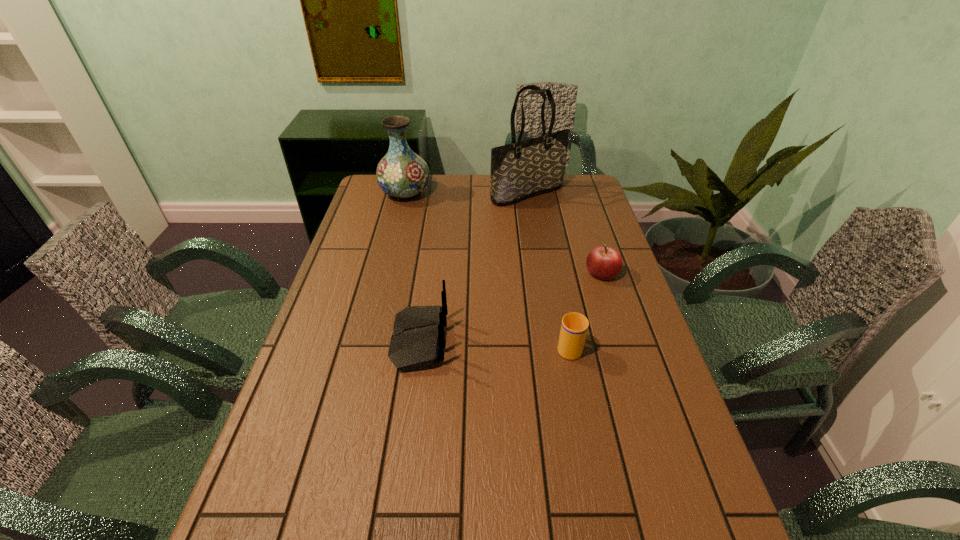
You are a GUI agent. You are given a task and a screenshot of the screen. Output one action in this format:
    pyautogui.click(x=<x>, y=<y>)
    Task: Click on the tallest object
    The width and height of the screenshot is (960, 540).
    Given the screenshot: What is the action you would take?
    pyautogui.click(x=522, y=169)

What are the coordinates of `the fourth shortest object` in the screenshot? It's located at tap(401, 173).

You are a GUI agent. You are given a task and a screenshot of the screen. Output one action in this format:
    pyautogui.click(x=<x>, y=<y>)
    Task: Click on the third tallest object
    This screenshot has height=540, width=960.
    Given the screenshot: What is the action you would take?
    pyautogui.click(x=417, y=342)

The width and height of the screenshot is (960, 540). I want to click on cup, so click(574, 326).

You are a GUI agent. You are given a task and a screenshot of the screen. Output one action in this format:
    pyautogui.click(x=<x>, y=<y>)
    Task: Click on the apple
    This screenshot has height=540, width=960.
    Given the screenshot: What is the action you would take?
    pyautogui.click(x=604, y=263)

Find the location of a particular element. The image size is (960, 540). vacant space situated 0.340m on the left of the tallest object is located at coordinates (404, 193).

Where is `vacant point located 0.380m on the front of the second tallest object`? vacant point located 0.380m on the front of the second tallest object is located at coordinates click(386, 271).

Locate an element on the screen. The width and height of the screenshot is (960, 540). free space located on the back of the router is located at coordinates (466, 341).

Find the location of a particular element. The width and height of the screenshot is (960, 540). blank area located on the side of the cup with the handle is located at coordinates (549, 245).

The width and height of the screenshot is (960, 540). I want to click on vacant space located 0.330m on the side of the cup with the handle, so click(x=552, y=258).